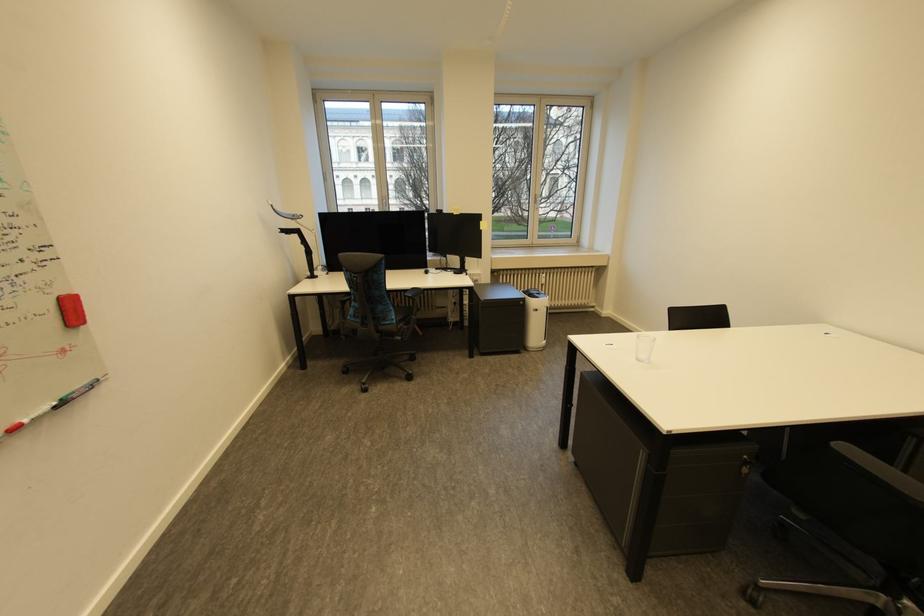
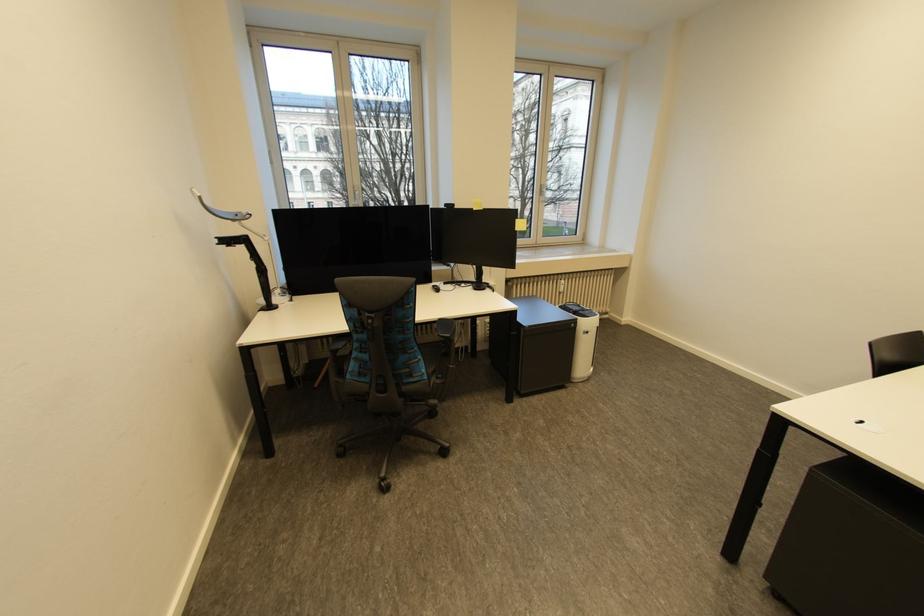
In a continuous first-person perspective shot, in which direction is the camera moving?

The cameraman moved toward left, forward.